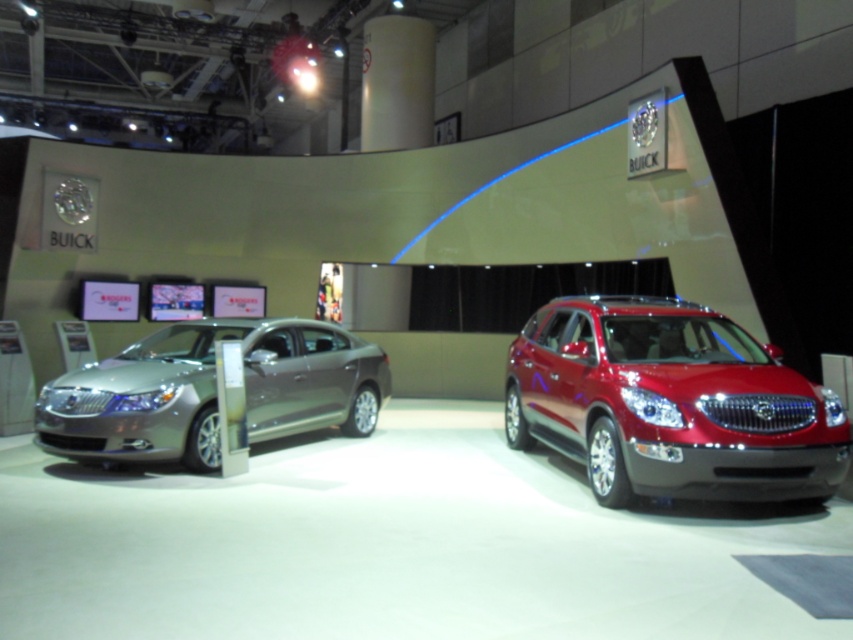
Question: In this image, where is glossy red suv at center located relative to satin silver sedan at left?

Choices:
 (A) right
 (B) left

Answer: (A)

Question: Can you confirm if glossy red suv at center is thinner than satin silver sedan at left?

Choices:
 (A) yes
 (B) no

Answer: (A)

Question: Which point is farther from the camera taking this photo?

Choices:
 (A) (183, 380)
 (B) (599, 465)

Answer: (A)

Question: Among these objects, which one is nearest to the camera?

Choices:
 (A) satin silver sedan at left
 (B) glossy red suv at center

Answer: (B)

Question: Can you confirm if glossy red suv at center is smaller than satin silver sedan at left?

Choices:
 (A) yes
 (B) no

Answer: (A)